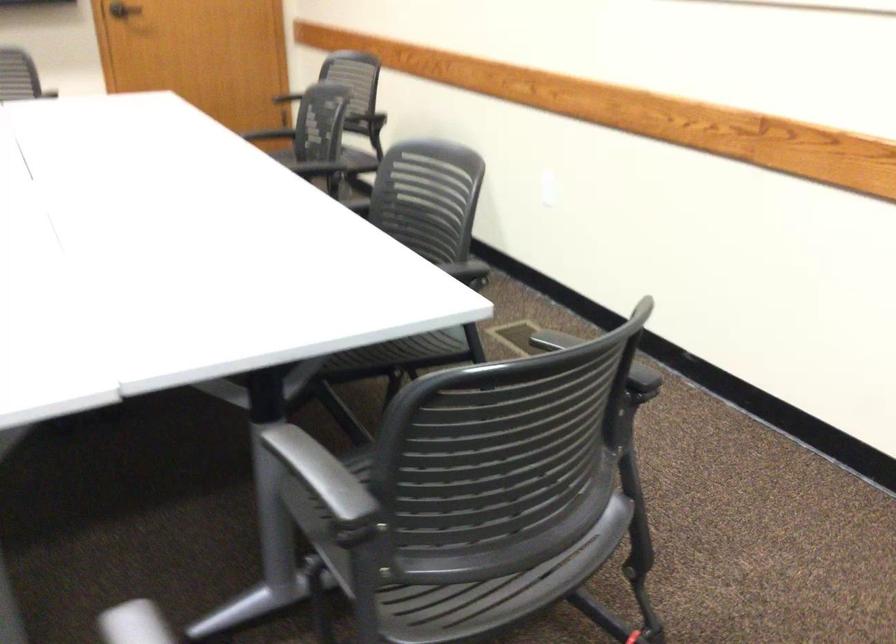
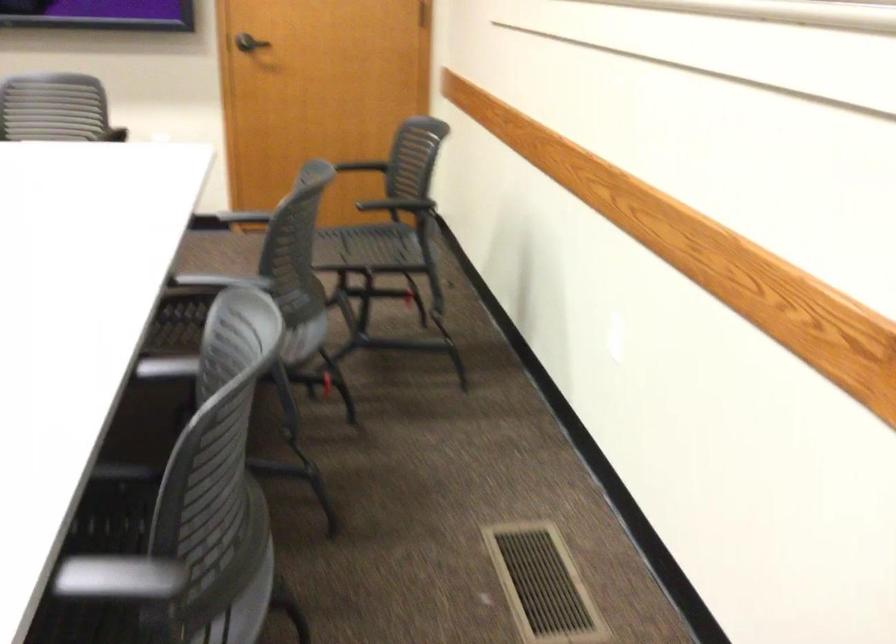
In a continuous first-person perspective shot, in which direction is the camera moving?

The cameraman walked toward right, forward.